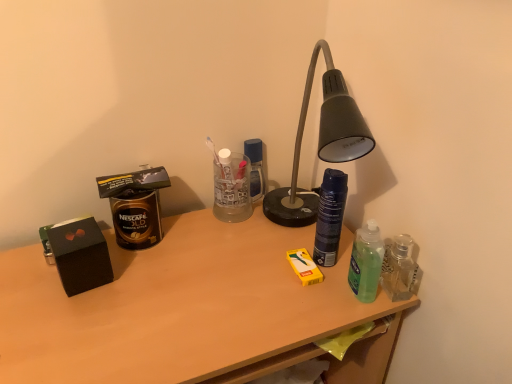
The image size is (512, 384). I want to click on free space to the left of green translucent bottle at right, which is the first bottle in right-to-left order, so click(298, 286).